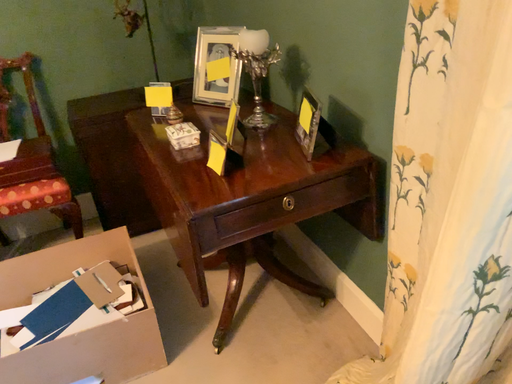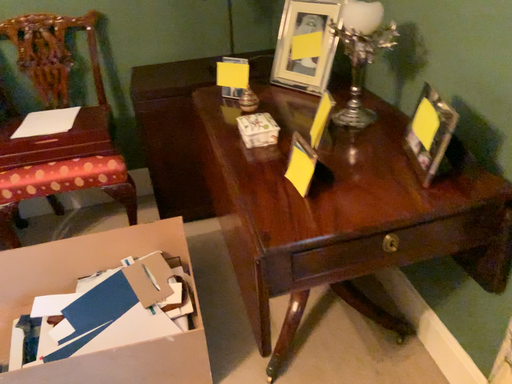
Question: Which way did the camera rotate in the video?

Choices:
 (A) rotated right
 (B) rotated left

Answer: (B)